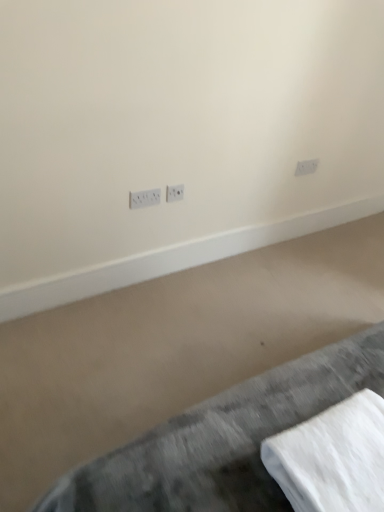
Question: Is white cotton towel at lower right with white plastic power plugs and sockets at center, which is the 3th power plugs and sockets in right-to-left order?

Choices:
 (A) no
 (B) yes

Answer: (A)

Question: Does white cotton towel at lower right have a larger size compared to white plastic power plugs and sockets at center, which is the 1th power plugs and sockets from bottom to top?

Choices:
 (A) yes
 (B) no

Answer: (A)

Question: From a real-world perspective, is white cotton towel at lower right physically below white plastic power plugs and sockets at center, which is the 3th power plugs and sockets in right-to-left order?

Choices:
 (A) yes
 (B) no

Answer: (B)

Question: From a real-world perspective, is white cotton towel at lower right physically above white plastic power plugs and sockets at center, placed as the 1th power plugs and sockets when sorted from left to right?

Choices:
 (A) no
 (B) yes

Answer: (B)

Question: From the image's perspective, is white cotton towel at lower right located beneath white plastic power plugs and sockets at center, acting as the 3th power plugs and sockets starting from the top?

Choices:
 (A) yes
 (B) no

Answer: (A)

Question: Is white cotton towel at lower right in front of white plastic power plugs and sockets at center, which is the 3th power plugs and sockets in right-to-left order?

Choices:
 (A) no
 (B) yes

Answer: (B)

Question: Is white plastic power plugs and sockets at center, marked as the 1th power plugs and sockets in a front-to-back arrangement, smaller than white plastic power plugs and sockets at center, which ranks as the 2th power plugs and sockets in left-to-right order?

Choices:
 (A) no
 (B) yes

Answer: (A)

Question: Can you confirm if white plastic power plugs and sockets at center, which is the 3th power plugs and sockets in right-to-left order, is positioned to the right of white plastic power plugs and sockets at center, placed as the second power plugs and sockets when sorted from bottom to top?

Choices:
 (A) yes
 (B) no

Answer: (B)

Question: Can you confirm if white plastic power plugs and sockets at center, marked as the 1th power plugs and sockets in a front-to-back arrangement, is bigger than white plastic power plugs and sockets at center, the 2th power plugs and sockets when ordered from front to back?

Choices:
 (A) yes
 (B) no

Answer: (A)

Question: Considering the relative sizes of white plastic power plugs and sockets at center, which appears as the 3th power plugs and sockets when viewed from the back, and white plastic power plugs and sockets at center, the 2th power plugs and sockets when ordered from front to back, in the image provided, is white plastic power plugs and sockets at center, which appears as the 3th power plugs and sockets when viewed from the back, thinner than white plastic power plugs and sockets at center, the 2th power plugs and sockets when ordered from front to back,?

Choices:
 (A) no
 (B) yes

Answer: (A)

Question: Is there a large distance between white plastic power plugs and sockets at center, which appears as the 3th power plugs and sockets when viewed from the back, and white plastic power plugs and sockets at center, which is counted as the second power plugs and sockets, starting from the back?

Choices:
 (A) no
 (B) yes

Answer: (A)

Question: Is white plastic power plugs and sockets at center, which is the 1th power plugs and sockets from bottom to top, not within white plastic power plugs and sockets at center, which is counted as the second power plugs and sockets, starting from the back?

Choices:
 (A) yes
 (B) no

Answer: (A)

Question: Can you confirm if gray fabric bed at lower right is wider than white plastic power plugs and sockets at upper right, the third power plugs and sockets positioned from the bottom?

Choices:
 (A) yes
 (B) no

Answer: (A)